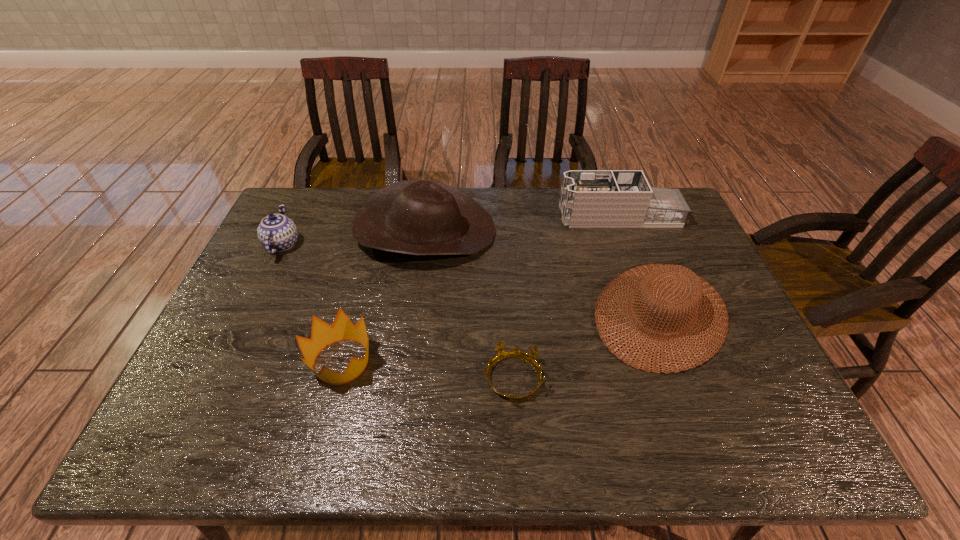
What are the coordinates of `unoccupied position between the shorter crown and the taller crown` in the screenshot? It's located at (427, 370).

At what (x,y) coordinates should I click in order to perform the action: click on free space between the second tallest object and the cowboy hat. Please return your answer as a coordinate pair (x, y). The width and height of the screenshot is (960, 540). Looking at the image, I should click on (522, 224).

This screenshot has height=540, width=960. In order to click on vacant space that is in between the right crown and the chinaware in this screenshot , I will do `click(397, 312)`.

I want to click on vacant space in between the taller crown and the sunhat, so click(501, 338).

The image size is (960, 540). I want to click on empty location between the leftmost object and the left crown, so click(312, 303).

I want to click on free space between the sunhat and the chinaware, so click(471, 279).

Where is `free space between the dollhouse and the taller crown`? This screenshot has width=960, height=540. free space between the dollhouse and the taller crown is located at coordinates (480, 289).

Where is `blank region between the taller crown and the leftmost object`? This screenshot has height=540, width=960. blank region between the taller crown and the leftmost object is located at coordinates (312, 303).

The image size is (960, 540). I want to click on object that ranks as the third closest to the fifth shortest object, so coord(530,358).

Locate an element on the screen. object that is the closest to the shorter crown is located at coordinates (658, 276).